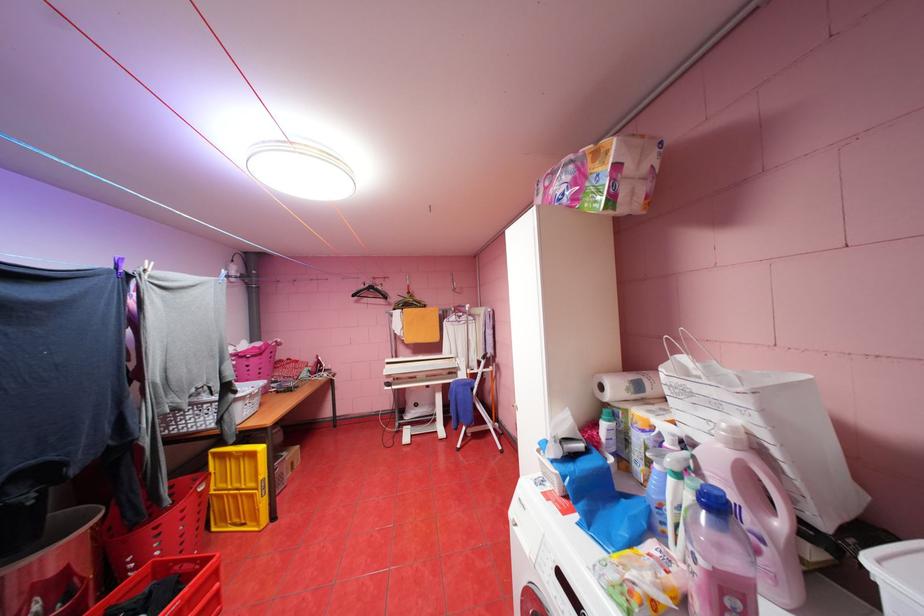
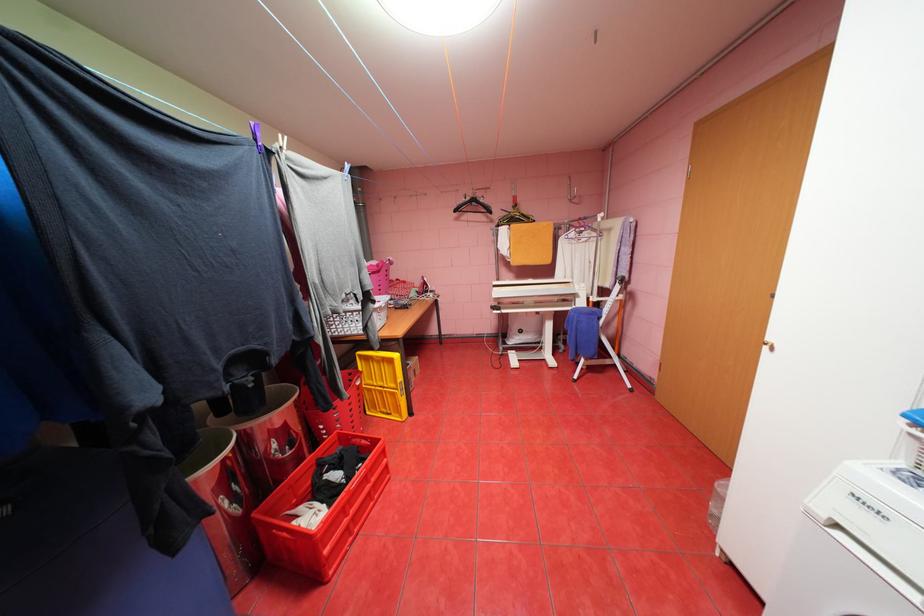
Find the pixel in the second image that matches pixel 169 569 in the first image.

(351, 438)